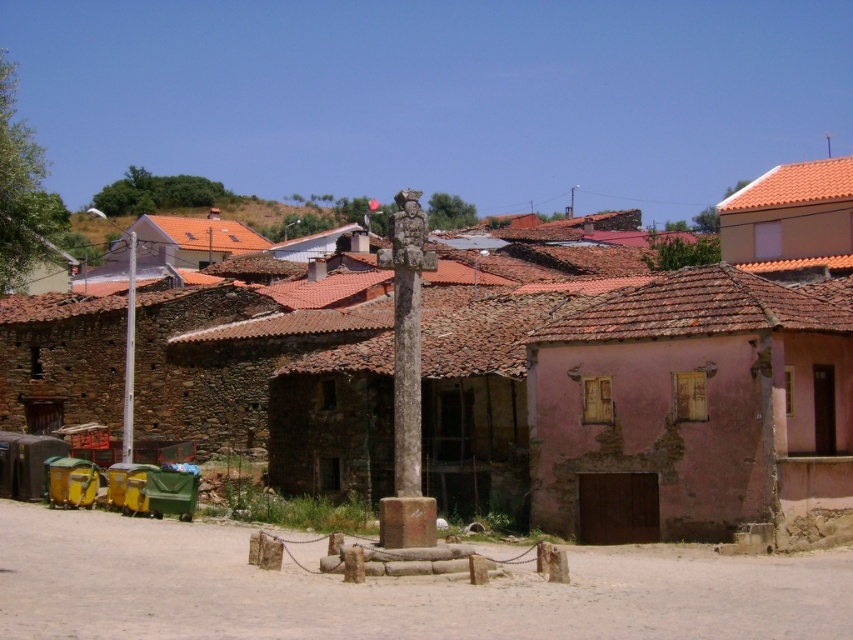
Where is `stone cross at center`? The image size is (853, 640). stone cross at center is located at coordinates (642, 401).

Which is above, stone cross at center or white stone pillar at center?

Positioned higher is stone cross at center.

This screenshot has height=640, width=853. What do you see at coordinates (642, 401) in the screenshot?
I see `stone cross at center` at bounding box center [642, 401].

Find the location of a particular element. This screenshot has height=640, width=853. stone cross at center is located at coordinates (642, 401).